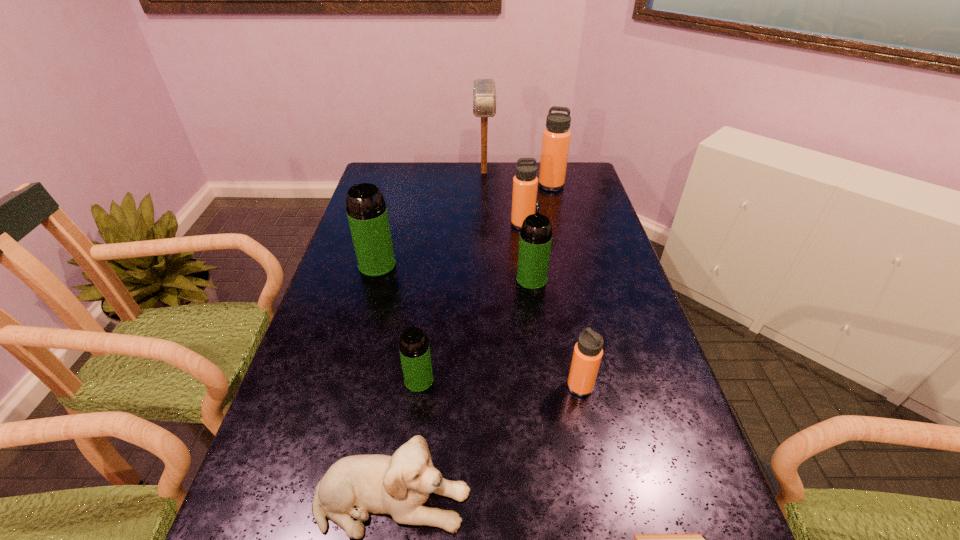
The width and height of the screenshot is (960, 540). Find the location of `mallet`. mallet is located at coordinates (484, 90).

This screenshot has width=960, height=540. I want to click on the leftmost thermos bottle, so click(366, 209).

Image resolution: width=960 pixels, height=540 pixels. What are the coordinates of `the biggest green thermos bottle` in the screenshot? It's located at (366, 209).

I want to click on the biggest orange thermos bottle, so click(556, 136).

Where is `the farthest orange thermos bottle`? the farthest orange thermos bottle is located at coordinates (556, 136).

At what (x,y) coordinates should I click in order to perform the action: click on the second biggest green thermos bottle. Please return your answer as a coordinate pair (x, y). This screenshot has width=960, height=540. Looking at the image, I should click on (535, 240).

You are a GUI agent. You are given a task and a screenshot of the screen. Output one action in this format:
    pyautogui.click(x=<x>, y=<y>)
    Task: Click on the second farthest orange thermos bottle
    
    Given the screenshot: What is the action you would take?
    pyautogui.click(x=525, y=182)

This screenshot has width=960, height=540. I want to click on the third farthest object, so click(525, 182).

Identify the location of the nearest green thermos bottle. (414, 349).

Identify the location of the fifth thermos bottle from right to left. The image size is (960, 540). (414, 349).